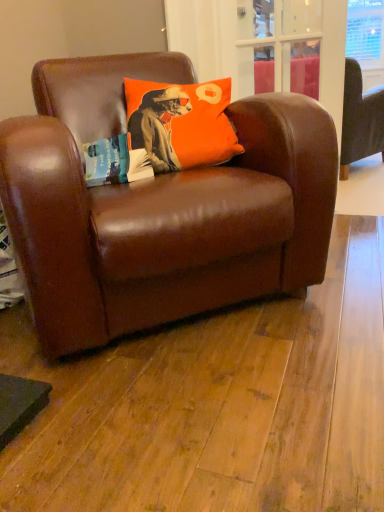
Question: Should I look upward or downward to see brown leather couch at upper right?

Choices:
 (A) up
 (B) down

Answer: (A)

Question: Can you confirm if brown leather couch at upper right is taller than orange matte pillow at upper center?

Choices:
 (A) no
 (B) yes

Answer: (B)

Question: From a real-world perspective, does brown leather couch at upper right sit lower than orange matte pillow at upper center?

Choices:
 (A) no
 (B) yes

Answer: (B)

Question: Is brown leather couch at upper right shorter than orange matte pillow at upper center?

Choices:
 (A) yes
 (B) no

Answer: (B)

Question: Is brown leather couch at upper right behind orange matte pillow at upper center?

Choices:
 (A) yes
 (B) no

Answer: (A)

Question: Considering the relative positions of brown leather couch at upper right and orange matte pillow at upper center in the image provided, is brown leather couch at upper right to the left of orange matte pillow at upper center from the viewer's perspective?

Choices:
 (A) no
 (B) yes

Answer: (A)

Question: Is brown leather couch at upper right oriented towards orange matte pillow at upper center?

Choices:
 (A) no
 (B) yes

Answer: (A)

Question: From a real-world perspective, is orange matte pillow at upper center on top of brown leather chair at center?

Choices:
 (A) yes
 (B) no

Answer: (A)

Question: Is orange matte pillow at upper center oriented away from brown leather chair at center?

Choices:
 (A) yes
 (B) no

Answer: (A)

Question: Does orange matte pillow at upper center have a greater height compared to brown leather chair at center?

Choices:
 (A) yes
 (B) no

Answer: (B)

Question: Is orange matte pillow at upper center positioned beyond the bounds of brown leather chair at center?

Choices:
 (A) no
 (B) yes

Answer: (A)

Question: Does orange matte pillow at upper center have a lesser height compared to brown leather chair at center?

Choices:
 (A) yes
 (B) no

Answer: (A)

Question: Does orange matte pillow at upper center turn towards brown leather chair at center?

Choices:
 (A) yes
 (B) no

Answer: (A)

Question: Is orange matte pillow at upper center further to camera compared to brown leather couch at upper right?

Choices:
 (A) yes
 (B) no

Answer: (B)